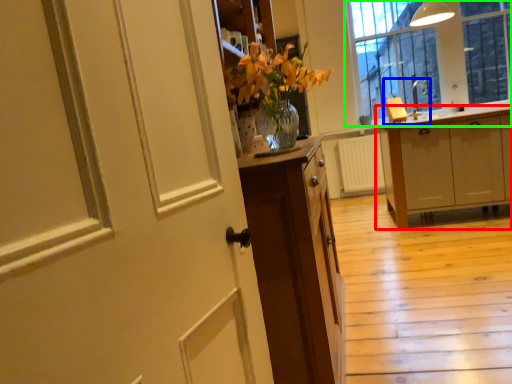
Question: Based on their relative distances, which object is nearer to cabinetry (highlighted by a red box)? Choose from sink (highlighted by a blue box) and window (highlighted by a green box).

Choices:
 (A) sink
 (B) window

Answer: (A)